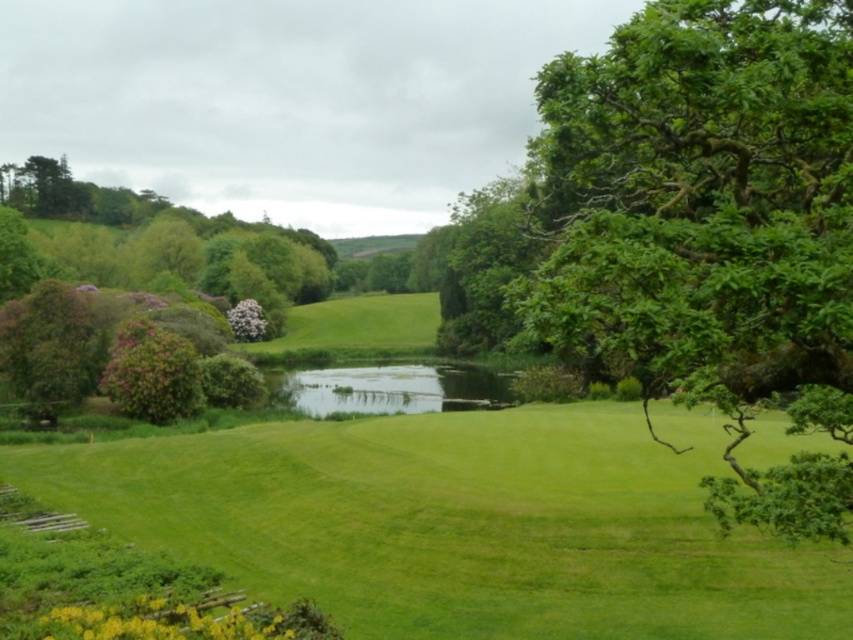
Question: Is green leafy tree at center right closer to camera compared to green grassy lake at center?

Choices:
 (A) no
 (B) yes

Answer: (B)

Question: Does green leafy tree at center right appear under green grassy lake at center?

Choices:
 (A) no
 (B) yes

Answer: (A)

Question: Among these objects, which one is nearest to the camera?

Choices:
 (A) green grassy lake at center
 (B) green leafy tree at center right

Answer: (B)

Question: Considering the relative positions of green leafy tree at center right and green grassy lake at center in the image provided, where is green leafy tree at center right located with respect to green grassy lake at center?

Choices:
 (A) above
 (B) below

Answer: (A)

Question: Which of the following is the closest to the observer?

Choices:
 (A) green grassy lake at center
 (B) green leafy tree at center right

Answer: (B)